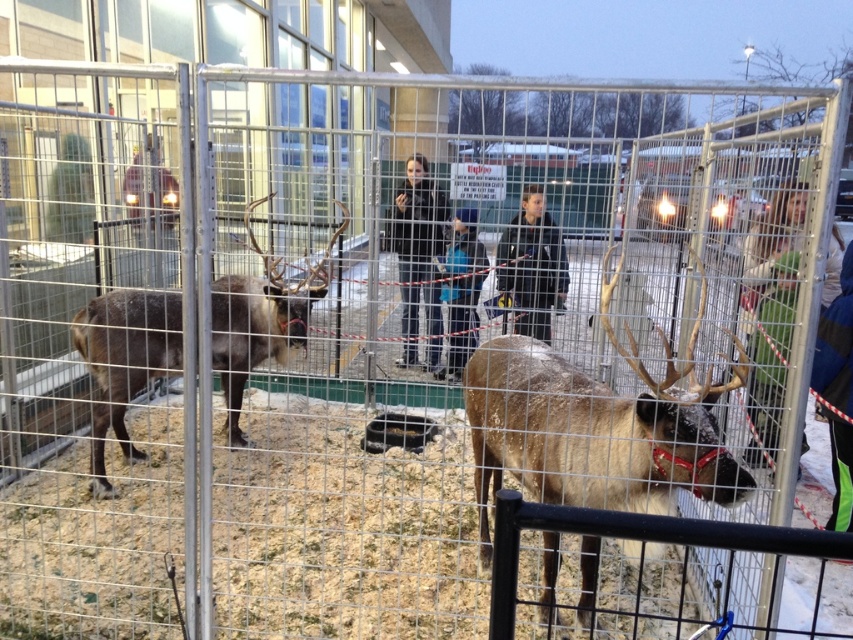
Question: Which point is farther from the camera taking this photo?

Choices:
 (A) (798, 230)
 (B) (218, 324)
 (C) (541, 308)

Answer: (C)

Question: Considering the relative positions of dark blue jacket at center and blue fabric jacket at center in the image provided, where is dark blue jacket at center located with respect to blue fabric jacket at center?

Choices:
 (A) above
 (B) below

Answer: (A)

Question: Does green fabric coat at center appear under black leather jacket at center?

Choices:
 (A) no
 (B) yes

Answer: (B)

Question: Estimate the real-world distances between objects in this image. Which object is closer to the brown fuzzy reindeer at left?

Choices:
 (A) green fabric coat at center
 (B) black leather jacket at center
 (C) light brown fur at center

Answer: (B)

Question: Estimate the real-world distances between objects in this image. Which object is closer to the dark blue jacket at center?

Choices:
 (A) blue fabric jacket at center
 (B) light brown fur at center
 (C) black leather jacket at center

Answer: (A)

Question: Does dark blue jacket at center appear under blue fabric jacket at center?

Choices:
 (A) yes
 (B) no

Answer: (B)